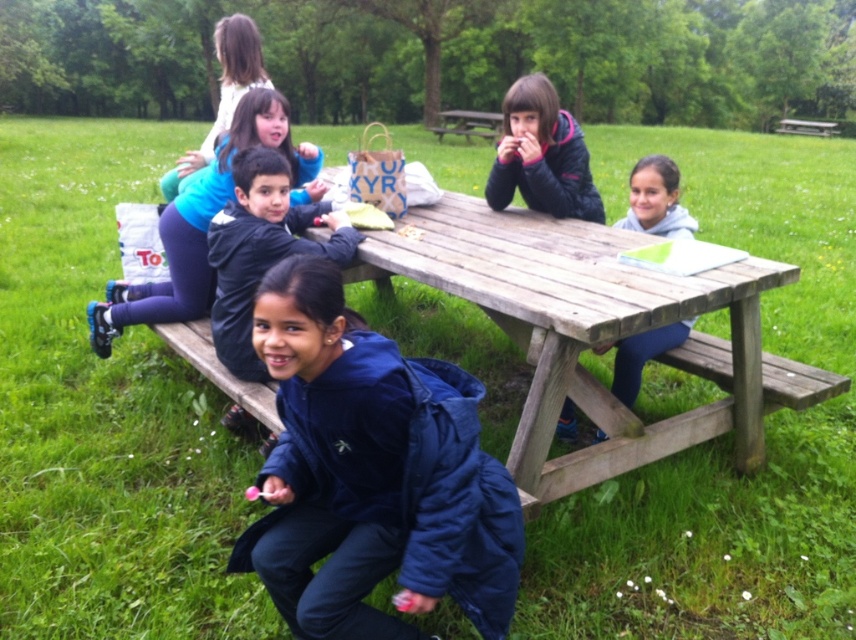
You are a photographer trying to capture the entire wooden picnic table at center and the light blue jeans at lower right in a single shot. Based on their sizes, which object would you need to position closer to the camera to ensure both fit in the frame?

The light blue jeans at lower right are smaller in size than the wooden picnic table at center. To include both in the frame, you should position the light blue jeans at lower right closer to the camera since it is smaller and needs to be enlarged in the shot to balance with the larger wooden picnic table at center.

You are a photographer standing at the edge of the grassy area and want to capture both the blue fabric jacket at lower center and the wooden bench at upper right in your photo. Which object should you focus on first to ensure both are in frame?

You should focus on the wooden bench at upper right first because the blue fabric jacket at lower center is taller than the wooden bench at upper right, so adjusting the frame to accommodate the taller jacket will naturally include the bench.

You are a photographer setting up a shot of the picnic area. You want to ensure both the blue fabric jacket at lower center and the wooden bench at upper right are clearly visible in the frame. Given their sizes, which object might require more careful framing to avoid being too small in the photo?

The blue fabric jacket at lower center occupies less space than the wooden bench at upper right, so it might require more careful framing to ensure it is not too small in the photo.